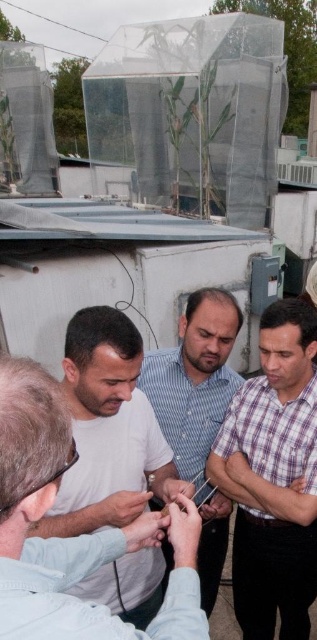
You are standing on the rooftop and want to know if the plaid shirt at center and the white matte shirt at center are close enough to hear each other without raising their voices. Can you determine this based on their distance?

The plaid shirt at center is 58.17 centimeters from the white matte shirt at center. Since this distance is very short, they can easily hear each other without needing to raise their voices.

You are part of the group observing something on the rooftop. You notice two people in the center wearing plaid shirt at center and blue striped shirt at center. Which one is closer to you?

The plaid shirt at center is closer to you because it is in front of the blue striped shirt at center.